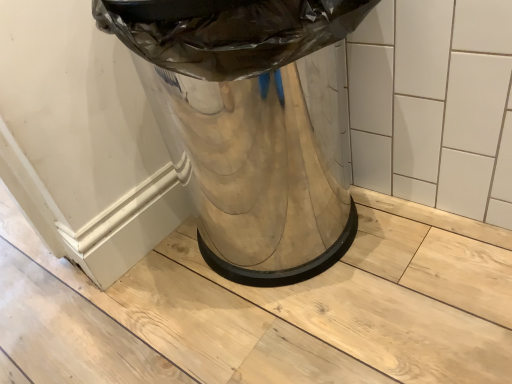
Question: From the image's perspective, is shiny metallic trash can at center located above or below white glossy tile at upper center?

Choices:
 (A) below
 (B) above

Answer: (A)

Question: From a real-world perspective, is shiny metallic trash can at center positioned above or below white glossy tile at upper center?

Choices:
 (A) below
 (B) above

Answer: (B)

Question: In the image, is shiny metallic trash can at center positioned in front of or behind white glossy tile at upper center?

Choices:
 (A) behind
 (B) front

Answer: (B)

Question: From a real-world perspective, relative to shiny metallic trash can at center, is white glossy tile at upper center vertically above or below?

Choices:
 (A) below
 (B) above

Answer: (A)

Question: Is white glossy tile at upper center to the left or to the right of shiny metallic trash can at center in the image?

Choices:
 (A) left
 (B) right

Answer: (B)

Question: Is white glossy tile at upper center wider or thinner than shiny metallic trash can at center?

Choices:
 (A) thin
 (B) wide

Answer: (A)

Question: Is white glossy tile at upper center taller or shorter than shiny metallic trash can at center?

Choices:
 (A) short
 (B) tall

Answer: (A)